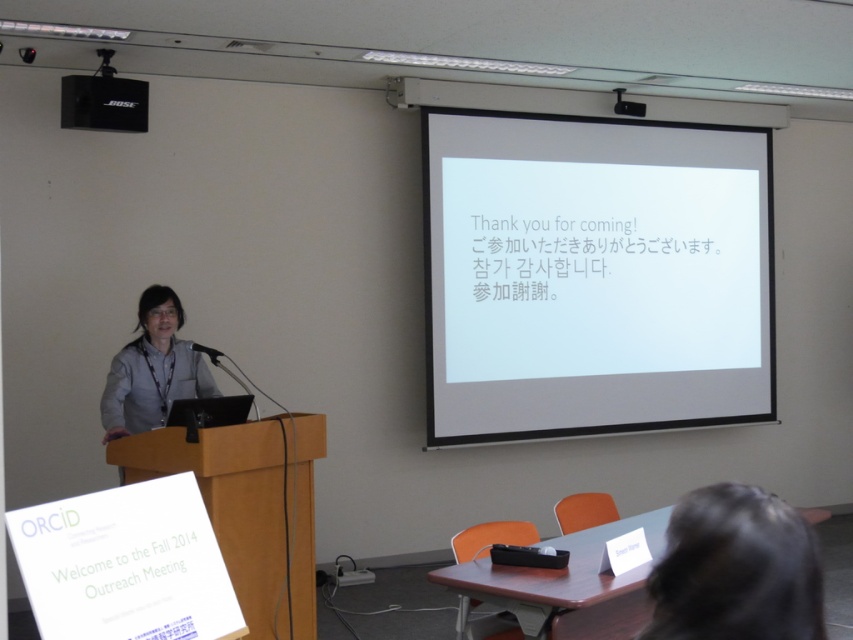
You are an attendee at the presentation and need to identify which object is taller between the gray fabric shirt at left and the black matte speaker at upper left. Based on the scene, which one is taller?

The gray fabric shirt at left is taller than the black matte speaker at upper left.

You are an attendee at the presentation and want to locate both the white matte projector screen at upper right and the black matte speaker at upper left. Which one is on the right side?

The white matte projector screen at upper right is positioned on the right side of the black matte speaker at upper left.

Based on the scene description, which object takes up more area in the image between the black hair at lower right and the gray fabric shirt at left?

The gray fabric shirt at left occupies more area than the black hair at lower right in the image.